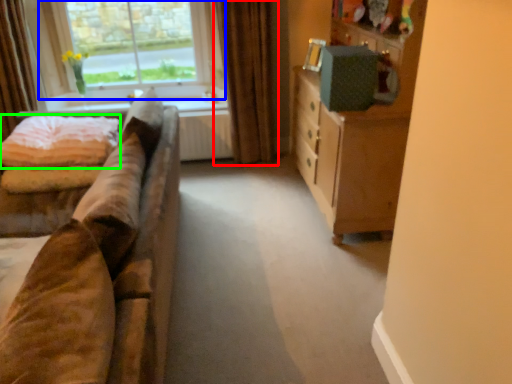
Question: Which object is the farthest from curtain (highlighted by a red box)? Choose among these: window (highlighted by a blue box) or quilt (highlighted by a green box).

Choices:
 (A) window
 (B) quilt

Answer: (B)